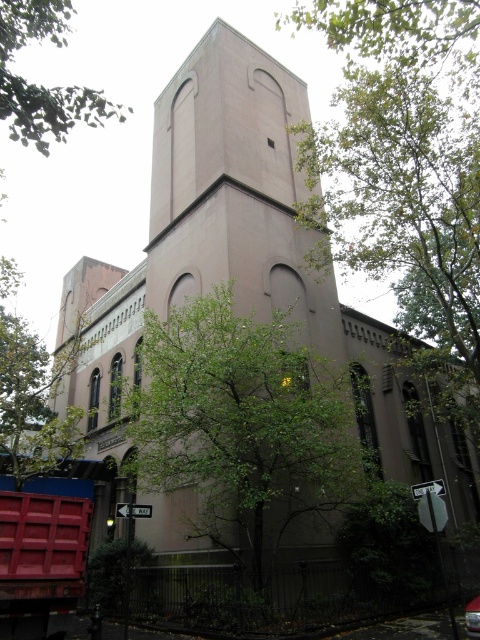
Question: Which object is closer to the camera taking this photo?

Choices:
 (A) green leafy tree at upper left
 (B) green leafy tree at center

Answer: (A)

Question: Is green leafy tree at center smaller than green leafy tree at upper left?

Choices:
 (A) no
 (B) yes

Answer: (B)

Question: Does green leafy tree at center appear on the right side of green leafy tree at upper left?

Choices:
 (A) yes
 (B) no

Answer: (A)

Question: Which object is farther from the camera taking this photo?

Choices:
 (A) green leafy tree at upper left
 (B) green leafy tree at center

Answer: (B)

Question: Is green leafy tree at center wider than green leafy tree at upper left?

Choices:
 (A) yes
 (B) no

Answer: (B)